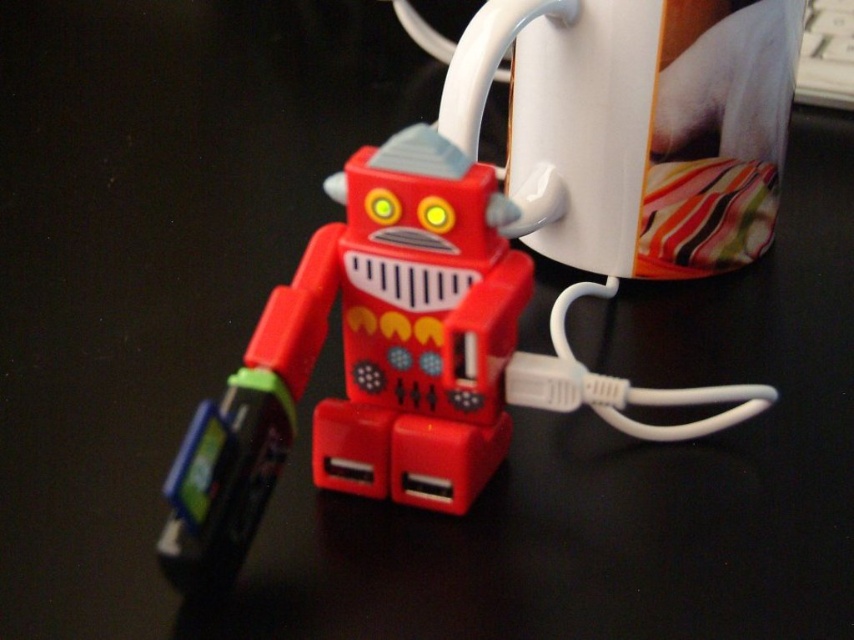
Which is above, rubberized plastic robot at center or white glossy mug at upper center?

white glossy mug at upper center

Does rubberized plastic robot at center appear on the right side of white glossy mug at upper center?

Incorrect, rubberized plastic robot at center is not on the right side of white glossy mug at upper center.

The width and height of the screenshot is (854, 640). Find the location of `rubberized plastic robot at center`. rubberized plastic robot at center is located at coordinates (367, 358).

At what (x,y) coordinates should I click in order to perform the action: click on rubberized plastic robot at center. Please return your answer as a coordinate pair (x, y). Image resolution: width=854 pixels, height=640 pixels. Looking at the image, I should click on (367, 358).